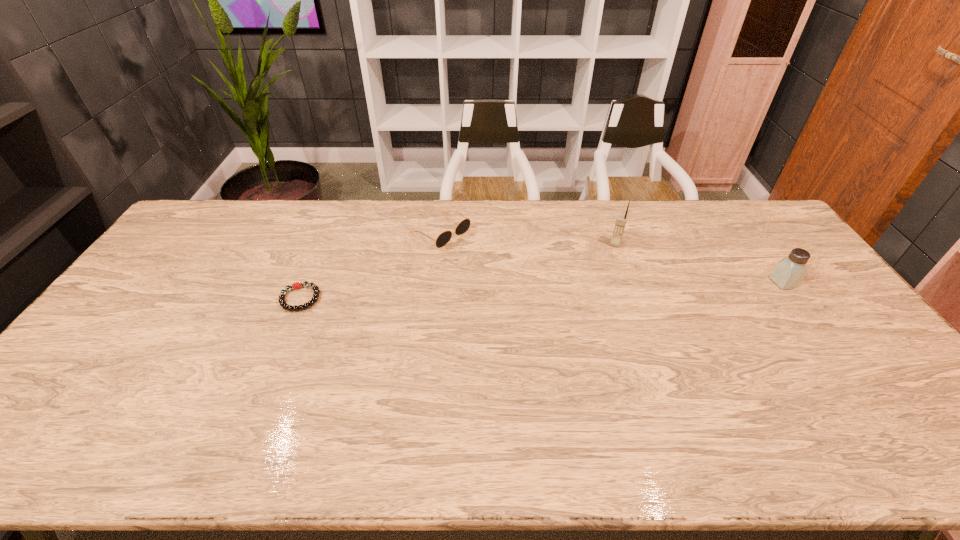
In order to click on free location at the left edge of the desktop in this screenshot , I will do `click(170, 293)`.

The image size is (960, 540). Identify the location of vacant space at the far left corner of the desktop. (199, 210).

In the image, there is a desktop. Where is `vacant space at the far right corner`? This screenshot has width=960, height=540. vacant space at the far right corner is located at coordinates (732, 207).

Where is `free spot between the bracelet and the second shortest object`? free spot between the bracelet and the second shortest object is located at coordinates 371,265.

I want to click on free space between the third tallest object and the leftmost object, so [371, 265].

This screenshot has height=540, width=960. In order to click on unoccupied position between the tallest object and the bracelet in this screenshot , I will do `click(458, 271)`.

This screenshot has height=540, width=960. I want to click on free area in between the cellular telephone and the sunglasses, so (x=528, y=238).

Locate an element on the screen. This screenshot has height=540, width=960. vacant space in between the second object from right to left and the leftmost object is located at coordinates pyautogui.click(x=458, y=271).

Where is `free space that is in between the third shortest object and the cellular telephone`? This screenshot has height=540, width=960. free space that is in between the third shortest object and the cellular telephone is located at coordinates (699, 263).

Where is `free space between the cellular telephone and the shortest object`? Image resolution: width=960 pixels, height=540 pixels. free space between the cellular telephone and the shortest object is located at coordinates (458, 271).